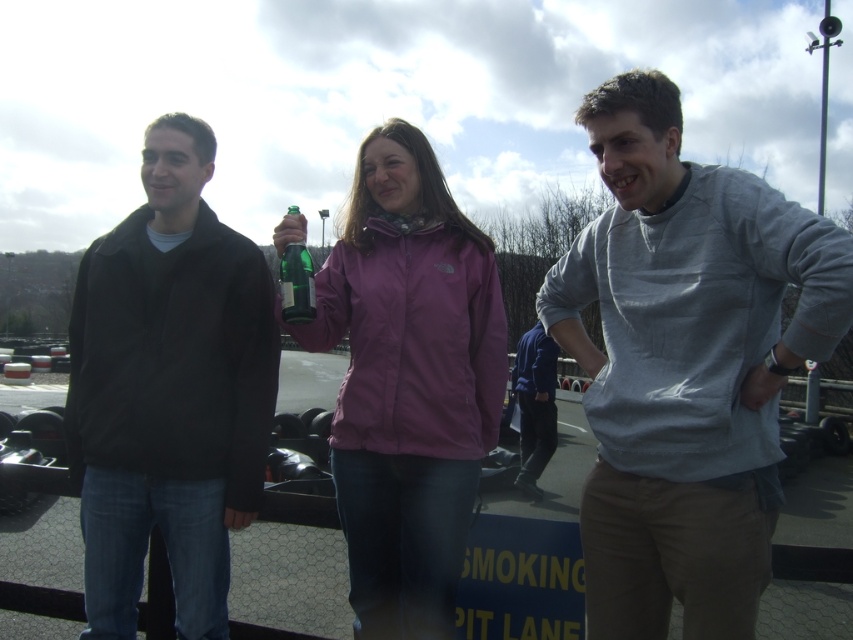
Question: Can you confirm if gray cotton shirt at center is smaller than blue fleece jacket at center?

Choices:
 (A) no
 (B) yes

Answer: (A)

Question: Which object appears farthest from the camera in this image?

Choices:
 (A) green glass bottle at center
 (B) blue fleece jacket at center
 (C) gray cotton shirt at center

Answer: (B)

Question: Does gray cotton shirt at center appear under matte black jacket at left?

Choices:
 (A) yes
 (B) no

Answer: (B)

Question: Which of the following is the closest to the observer?

Choices:
 (A) (628, 360)
 (B) (85, 497)
 (C) (537, 332)
 (D) (444, 260)

Answer: (A)

Question: Estimate the real-world distances between objects in this image. Which object is farther from the gray cotton shirt at center?

Choices:
 (A) green glass bottle at center
 (B) purple matte jacket at center
 (C) blue fleece jacket at center
 (D) matte black jacket at left

Answer: (C)

Question: Can you confirm if gray cotton shirt at center is positioned to the left of purple matte jacket at center?

Choices:
 (A) no
 (B) yes

Answer: (A)